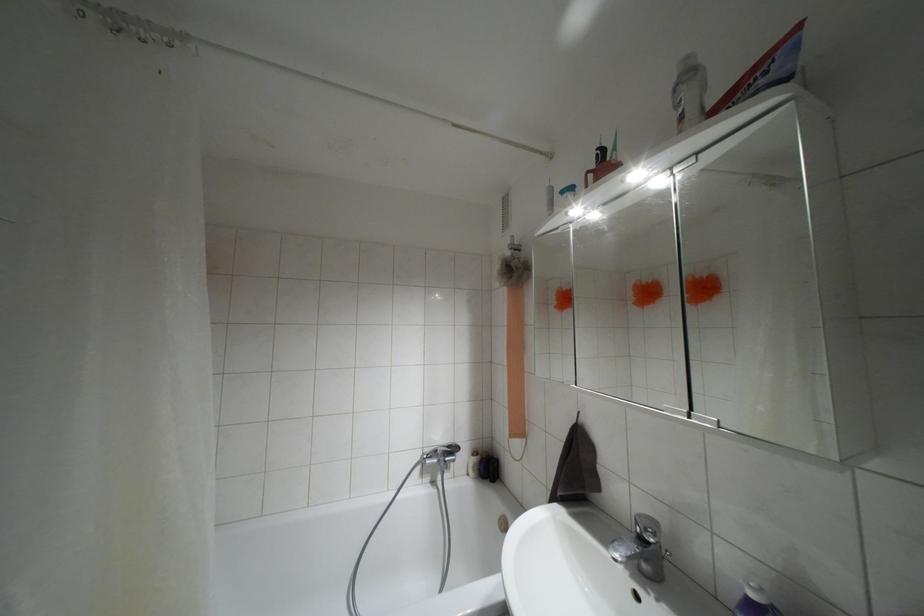
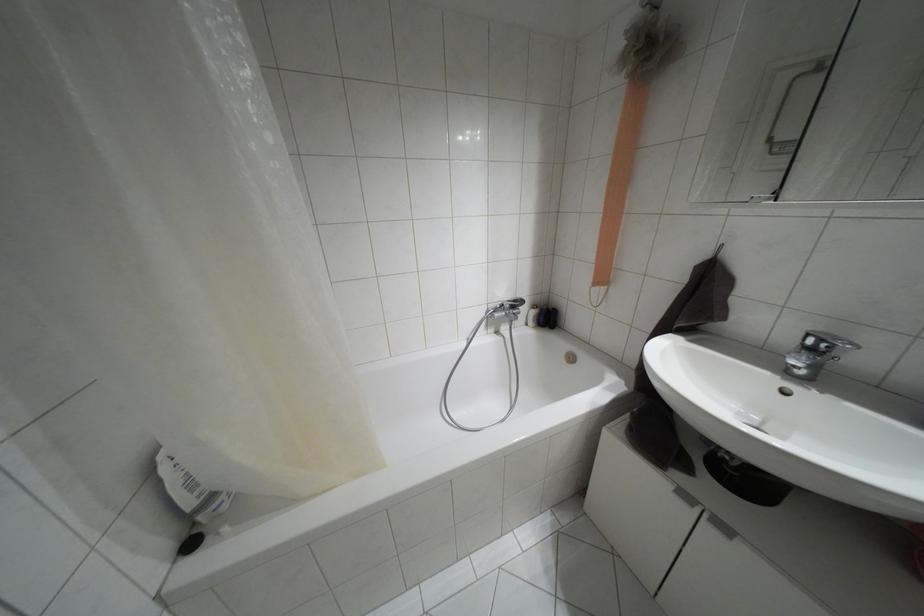
The images are taken continuously from a first-person perspective. In which direction are you moving?

The movement direction of the cameraman is left, forward.